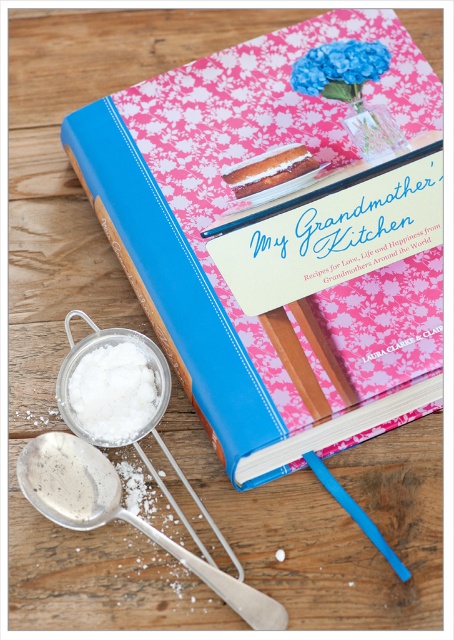
Looking at this image, where is the blue hardcover book at center located in the image?

The blue hardcover book at center is located at point (238, 204).

Please provide the exact coordinates of the silver metallic spoon at lower left in the image.

The silver metallic spoon at lower left is located at coordinates point [119,515].

What is located at the point with coordinates (238, 204) in the image?

The point at coordinates (238, 204) indicates the location of the blue hardcover book at center.